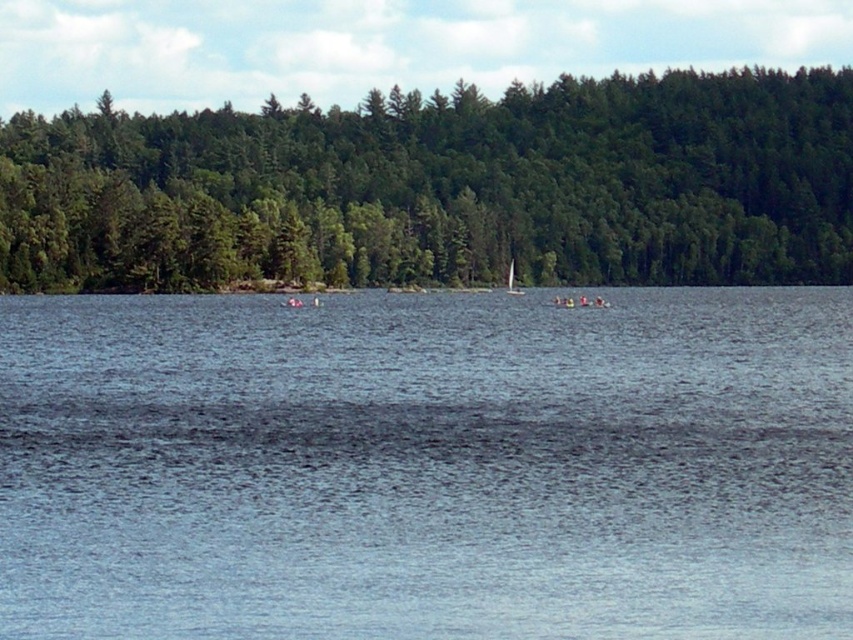
Question: Is blue water at center positioned in front of green matte forest at center?

Choices:
 (A) no
 (B) yes

Answer: (B)

Question: Considering the real-world distances, which object is farthest from the white glossy sailboat at center?

Choices:
 (A) blue water at center
 (B) green matte forest at center

Answer: (A)

Question: Which of the following is the farthest from the observer?

Choices:
 (A) (511, 268)
 (B) (677, 547)
 (C) (677, 150)

Answer: (C)

Question: Is blue water at center in front of green matte forest at center?

Choices:
 (A) yes
 (B) no

Answer: (A)

Question: In this image, where is blue water at center located relative to green matte forest at center?

Choices:
 (A) left
 (B) right

Answer: (B)

Question: Which of these objects is positioned farthest from the white glossy sailboat at center?

Choices:
 (A) green matte forest at center
 (B) blue water at center

Answer: (B)